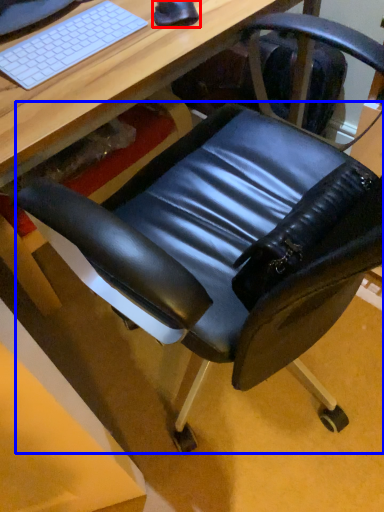
Question: Among these objects, which one is nearest to the camera, mouse (highlighted by a red box) or swivel chair (highlighted by a blue box)?

Choices:
 (A) mouse
 (B) swivel chair

Answer: (B)